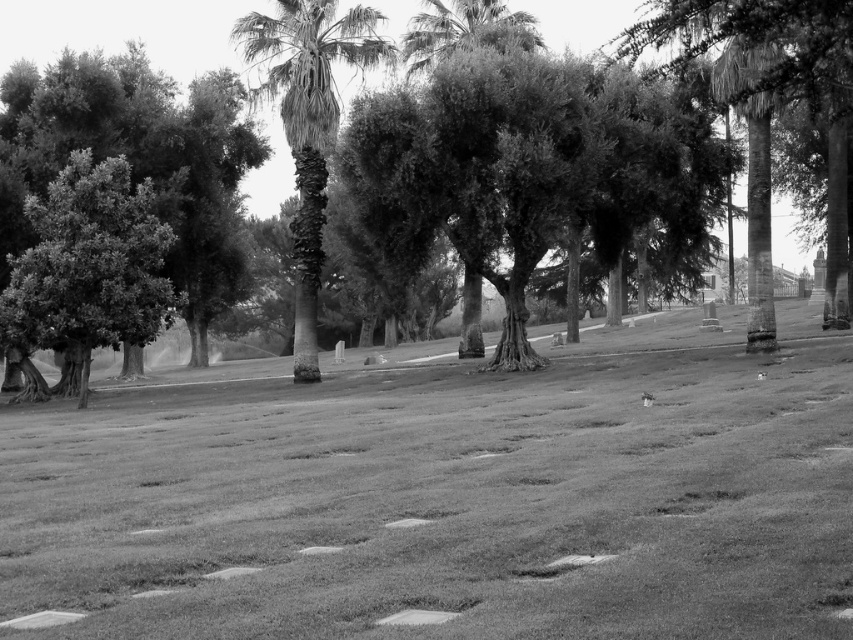
You are standing at the entrance of the cemetery and notice a point marked at coordinates (x=126, y=29). Which object in the scene is this point located on?

The point at coordinates (x=126, y=29) is located on the green leafy tree at center.

You are a landscape architect designing a new cemetery layout. You need to place a new headstone in an area where it won not be overshadowed by trees. Given the image, which tree between the green leafy tree at center and the smooth bark palm tree at center casts a bigger shadow and why?

The green leafy tree at center casts a bigger shadow because it is larger in size than the smooth bark palm tree at center.

You are standing at the edge of the cemetery and see the grassy lawn at center and the green leafy tree at center. Which object is located to the right of the other?

The grassy lawn at center is positioned on the right side of green leafy tree at center.